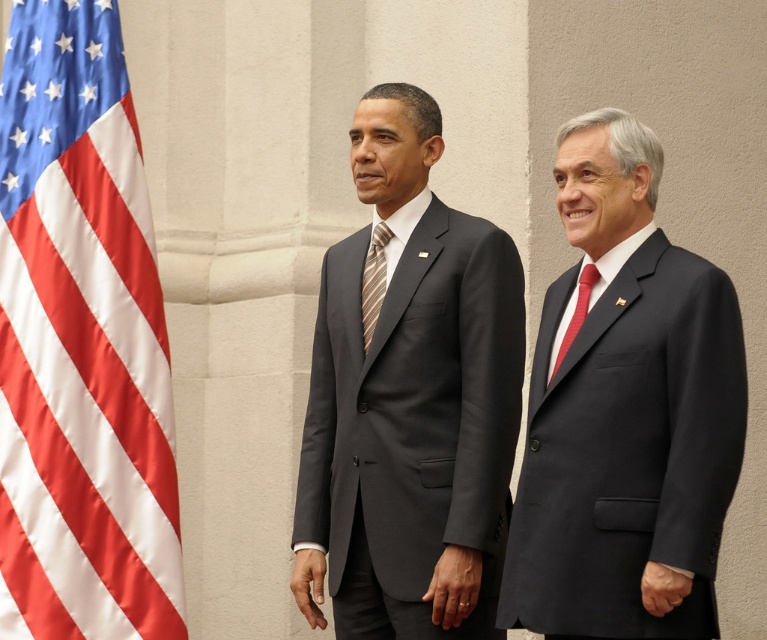
Can you confirm if matte black suit at center is smaller than striped fabric tie at center?

No.

This screenshot has height=640, width=767. Describe the element at coordinates (410, 401) in the screenshot. I see `matte black suit at center` at that location.

The width and height of the screenshot is (767, 640). What are the coordinates of `matte black suit at center` in the screenshot? It's located at (410, 401).

Find the location of a particular element. This screenshot has width=767, height=640. satin fabric flag at left is located at coordinates (81, 342).

Who is more forward, (129, 620) or (624, 193)?

Point (624, 193)

Where is `satin fabric flag at left`? The width and height of the screenshot is (767, 640). satin fabric flag at left is located at coordinates (81, 342).

Who is lower down, satin fabric flag at left or striped fabric tie at center?

satin fabric flag at left is below.

Is satin fabric flag at left thinner than striped fabric tie at center?

No.

Measure the distance between satin fabric flag at left and camera.

They are 30.18 meters apart.

What are the coordinates of `satin fabric flag at left` in the screenshot? It's located at (81, 342).